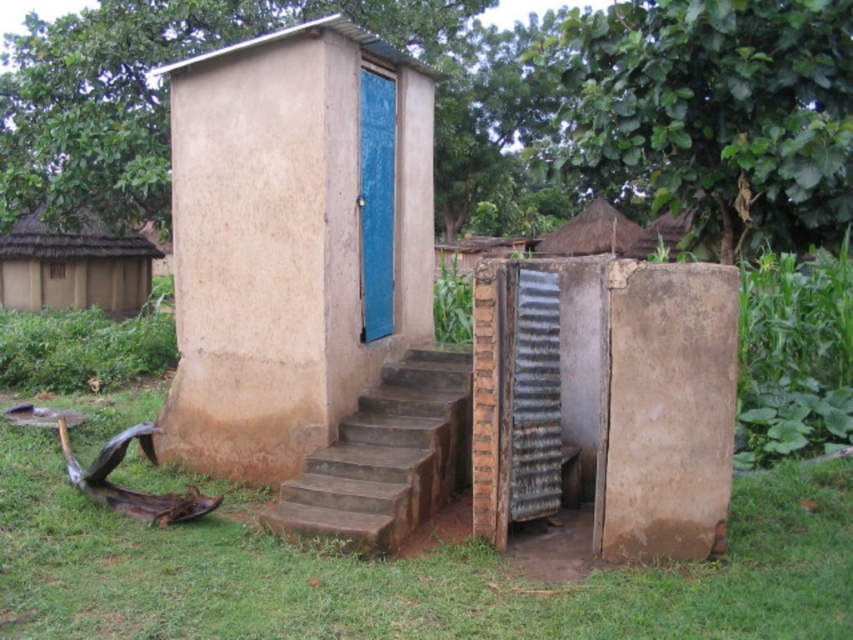
You are standing in front of the outdoor toilet structure and notice green grass at lower center and thatched roof hut at upper left. Which of these two objects is closer to the ground?

The green grass at lower center is shorter than thatched roof hut at upper left, so the green grass at lower center is closer to the ground.

You are standing in front of the matte clay hut at center and the thatched roof hut at upper left. Which one is more to the right?

The matte clay hut at center is positioned on the right side of thatched roof hut at upper left, so it is more to the right.